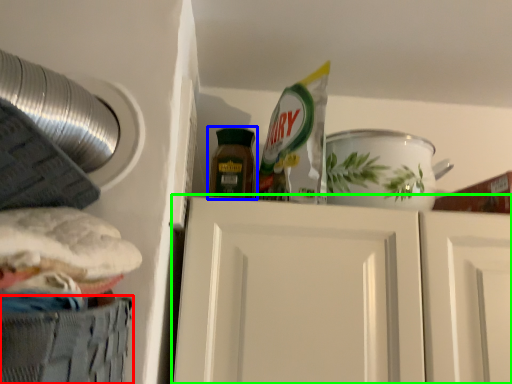
Question: Based on their relative distances, which object is farther from cabinetry (highlighted by a red box)? Choose from bottle (highlighted by a blue box) and door (highlighted by a green box).

Choices:
 (A) bottle
 (B) door

Answer: (A)